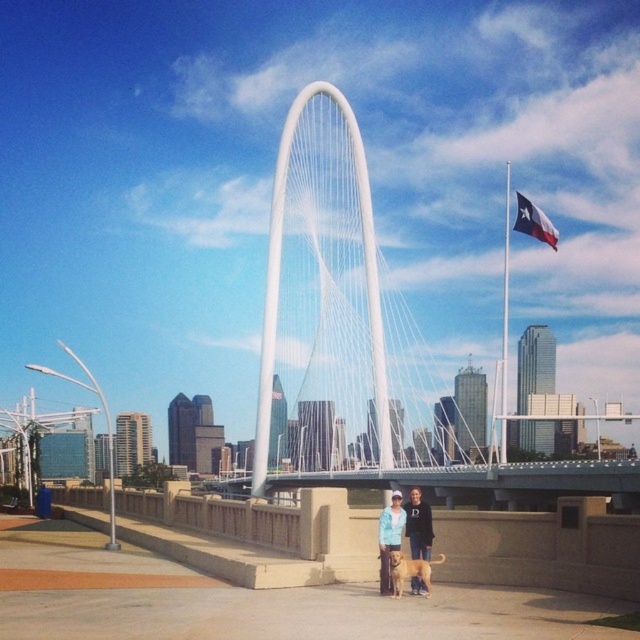
Based on the photo, you are standing on the paved area near the low concrete wall in the urban scene. You see two points marked in the image. Which point is closer to you, point [627,476] or point [403,528]?

Point [627,476] is closer to you because it is further to the viewer than point [403,528].